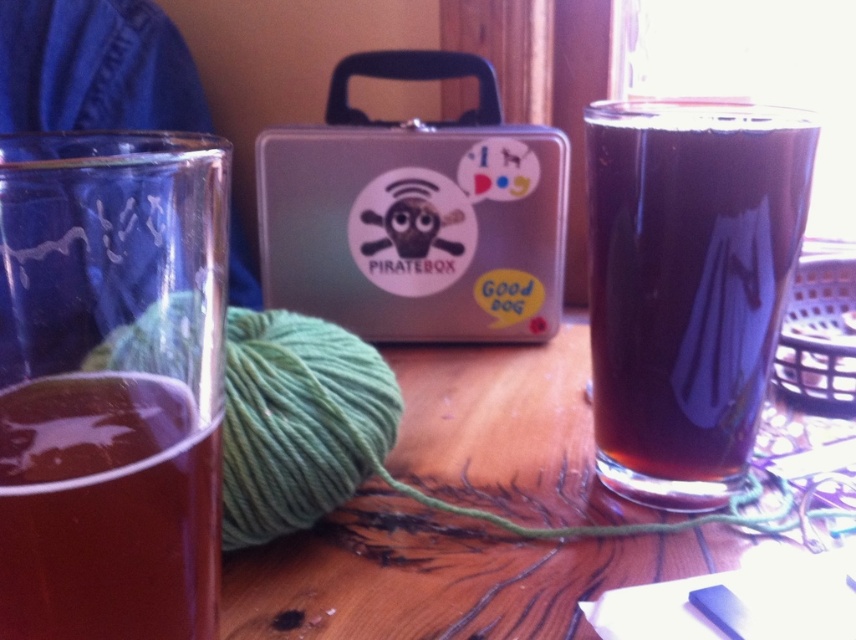
You are a delivery robot with a camera mounted 30 centimeters above the ground. You need to pick up the dark brown liquid at right using a robotic arm that can reach 28 centimeters. Can you successfully retrieve it?

The dark brown liquid at right is 26.20 centimeters away from the camera, so yes, the robotic arm can reach it since its maximum reach of 28 centimeters exceeds the distance of 26.20 centimeters.

You are a delivery robot tasked with placing a small package on the table. The package must be placed between the dark brown liquid at right and the brown translucent liquid at left. Can you do this without moving either liquid?

The dark brown liquid at right is closer to you than the brown translucent liquid at left. Since the dark brown liquid at right is closer, there is space between them for the package to be placed without moving either liquid.

You are a customer at a coffee shop and see the dark brown liquid at right and the brown translucent liquid at left on the table. Which liquid is closer to the edge of the table?

The dark brown liquid at right is closer to the edge of the table because it is positioned above the brown translucent liquid at left, which would place it nearer to the table edge.